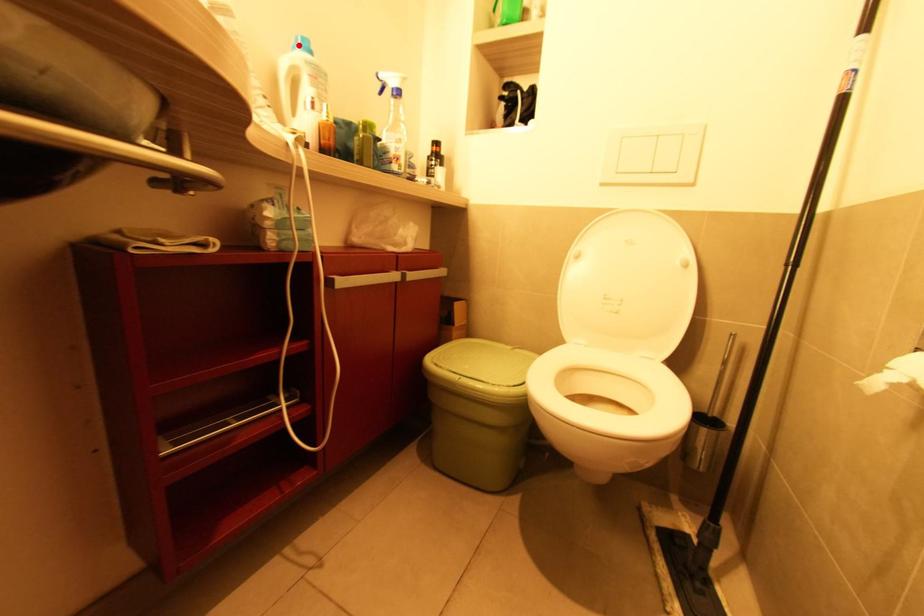
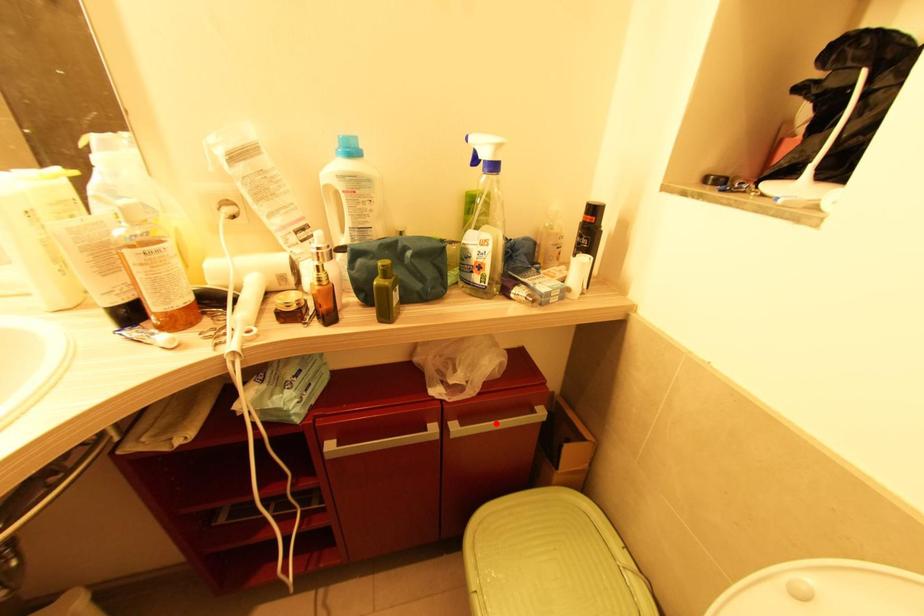
I am providing you with two images of the same scene from different viewpoints. A red point is marked on the first image and another point is marked on the second image. Do the highlighted points in image1 and image2 indicate the same real-world spot?

No